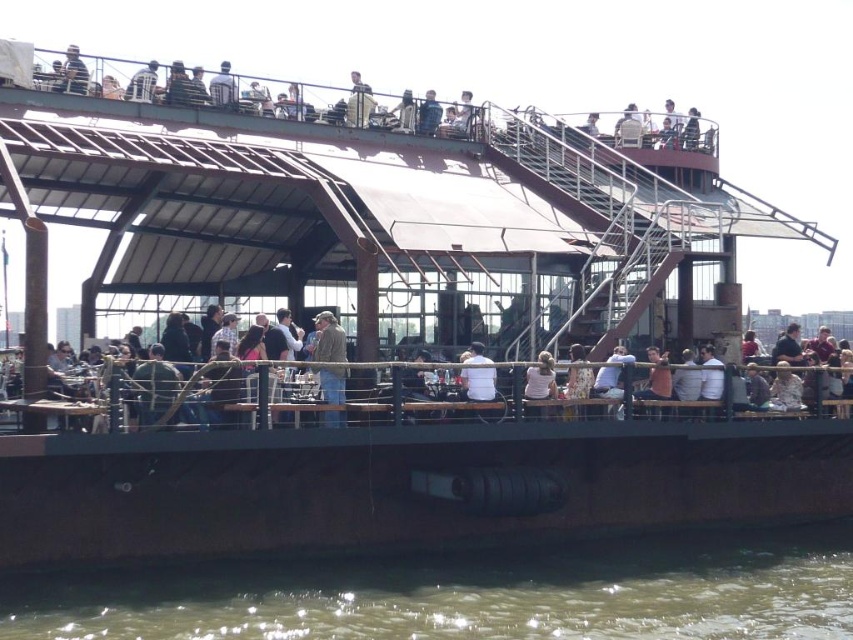
Question: Observing the image, what is the correct spatial positioning of white cotton shirt at center in reference to blue denim jacket at upper center?

Choices:
 (A) below
 (B) above

Answer: (A)

Question: Which point is farther to the camera?

Choices:
 (A) greenish water at lower center
 (B) blue denim jacket at upper center
 (C) light brown wooden chair at lower center
 (D) white fabric shirt at upper center

Answer: (B)

Question: Can you confirm if white cotton shirt at center is smaller than blue denim jacket at upper center?

Choices:
 (A) yes
 (B) no

Answer: (A)

Question: Is greenish water at lower center smaller than metallic silver jacket at upper center?

Choices:
 (A) no
 (B) yes

Answer: (B)

Question: Which object is positioned closest to the dark gray jacket at upper left?

Choices:
 (A) blue denim jacket at upper center
 (B) white fabric shirt at upper center

Answer: (B)

Question: Which of the following is the farthest from the observer?

Choices:
 (A) (209, 579)
 (B) (340, 333)
 (C) (223, 65)
 (D) (369, 92)

Answer: (D)